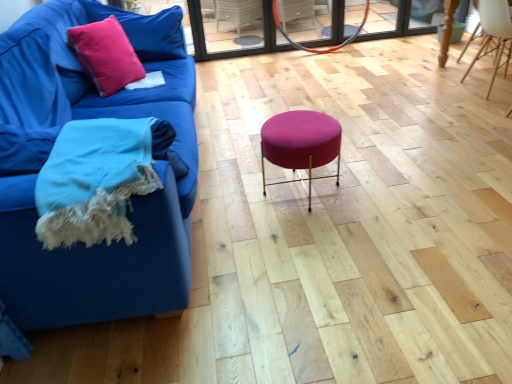
Question: From a real-world perspective, relative to matte pink fabric stool at center, is white wood chair at upper right vertically above or below?

Choices:
 (A) above
 (B) below

Answer: (A)

Question: In terms of width, does white wood chair at upper right look wider or thinner when compared to matte pink fabric stool at center?

Choices:
 (A) thin
 (B) wide

Answer: (B)

Question: Which object is the closest to the woolen blue blanket at lower left?

Choices:
 (A) pink velvet pillow at upper left
 (B) matte pink cushion at upper left
 (C) white wood chair at upper right
 (D) matte blue fabric couch at left
 (E) transparent glass door at upper center

Answer: (D)

Question: Which object is positioned closest to the white wood chair at upper right?

Choices:
 (A) transparent glass door at upper center
 (B) pink velvet pillow at upper left
 (C) matte pink cushion at upper left
 (D) matte blue fabric couch at left
 (E) matte pink fabric stool at center

Answer: (A)